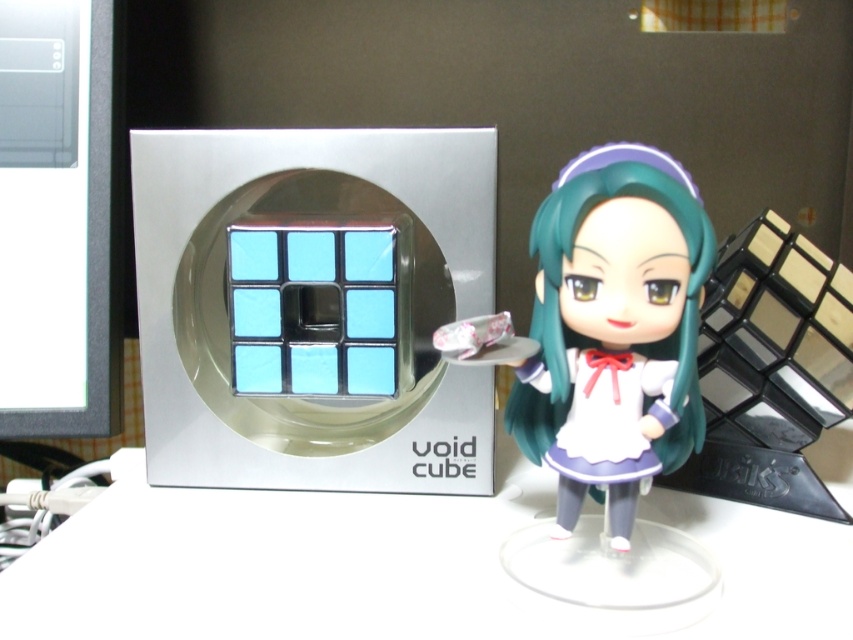
Question: Where is white glossy table at center located in relation to green matte hair at center in the image?

Choices:
 (A) left
 (B) right

Answer: (A)

Question: Observing the image, what is the correct spatial positioning of white glossy table at center in reference to green matte hair at center?

Choices:
 (A) left
 (B) right

Answer: (A)

Question: Among these objects, which one is farthest from the camera?

Choices:
 (A) white glossy table at center
 (B) green matte hair at center

Answer: (A)

Question: Which point is farther to the camera?

Choices:
 (A) white glossy table at center
 (B) green matte hair at center

Answer: (A)

Question: Considering the relative positions of white glossy table at center and green matte hair at center in the image provided, where is white glossy table at center located with respect to green matte hair at center?

Choices:
 (A) left
 (B) right

Answer: (A)